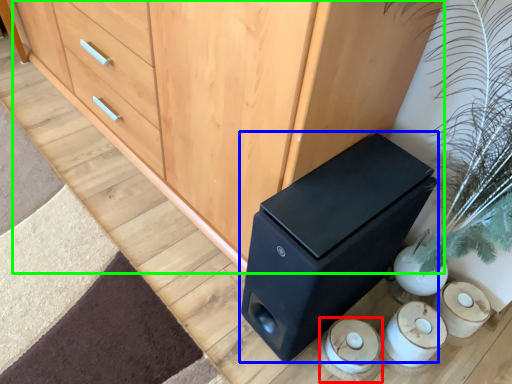
Question: Estimate the real-world distances between objects in this image. Which object is closer to candle holder (highlighted by a red box), furniture (highlighted by a blue box) or chest of drawers (highlighted by a green box)?

Choices:
 (A) furniture
 (B) chest of drawers

Answer: (A)